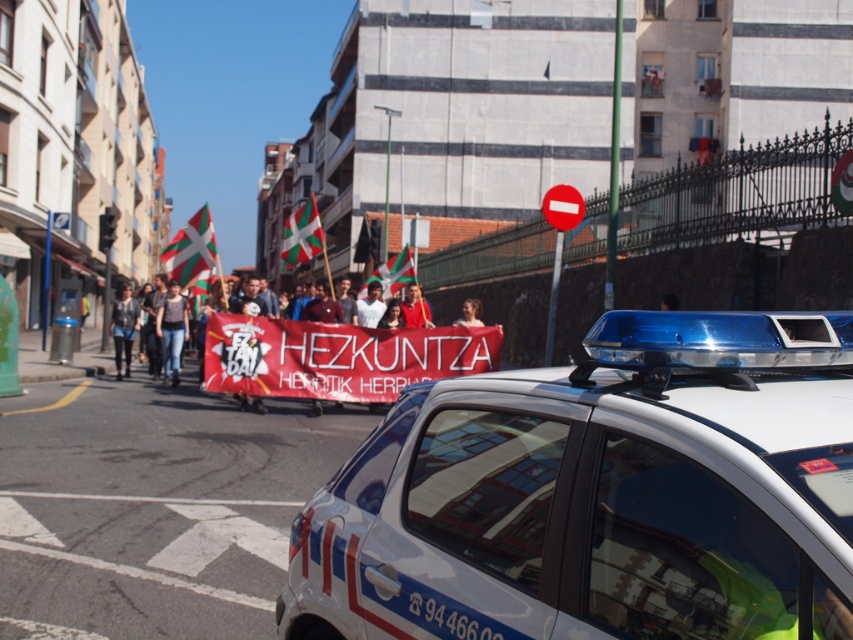
Question: Which point appears closest to the camera in this image?

Choices:
 (A) (476, 316)
 (B) (288, 240)
 (C) (212, 244)

Answer: (A)

Question: Does matte red banner at center have a smaller size compared to smooth skin face at center?

Choices:
 (A) yes
 (B) no

Answer: (A)

Question: In this image, where is matte red banner at center located relative to denim jeans at center?

Choices:
 (A) right
 (B) left

Answer: (A)

Question: Is red-green striped flag at left positioned before white and green striped flag at center?

Choices:
 (A) no
 (B) yes

Answer: (B)

Question: Which point is closer to the camera?

Choices:
 (A) (320, 237)
 (B) (268, 365)

Answer: (B)

Question: Which point is farther from the camera taking this photo?

Choices:
 (A) (397, 259)
 (B) (172, 289)
 (C) (550, 572)

Answer: (A)